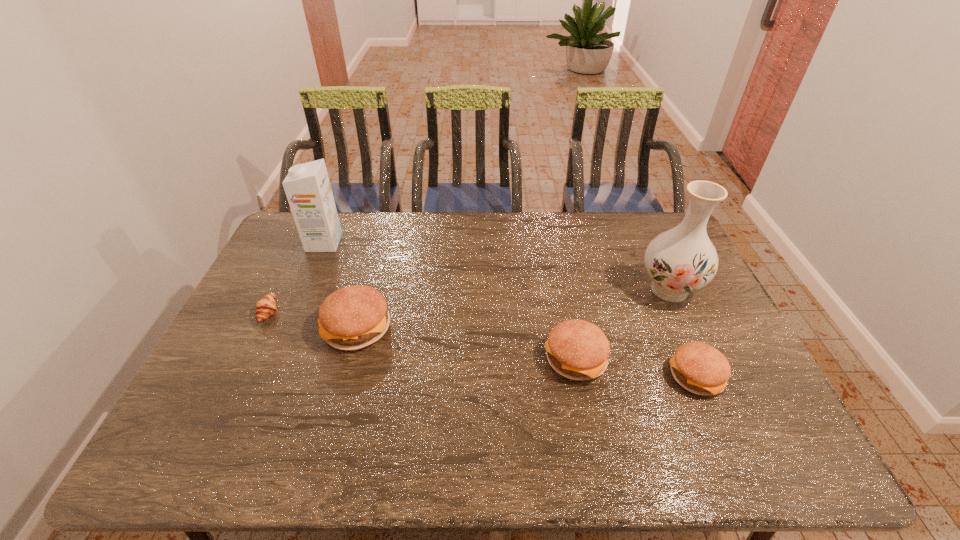
Choose which hamburger is the second nearest neighbor to the vase. Please provide its 2D coordinates. Your answer should be formatted as a tuple, i.e. [(x, y)], where the tuple contains the x and y coordinates of a point satisfying the conditions above.

[(576, 349)]

You are a GUI agent. You are given a task and a screenshot of the screen. Output one action in this format:
    pyautogui.click(x=<x>, y=<y>)
    Task: Click on the vacant space that satisfies the following two spatial constraints: 1. on the front-facing side of the pastry; 2. on the right side of the fourth object from left to right
    The height and width of the screenshot is (540, 960).
    Given the screenshot: What is the action you would take?
    pyautogui.click(x=245, y=359)

Identify the location of vacant space that satisfies the following two spatial constraints: 1. on the back side of the shortest hamburger; 2. on the front-facing side of the pastry. The image size is (960, 540). (668, 312).

Identify the location of free space that satisfies the following two spatial constraints: 1. on the front side of the fourth object from left to right; 2. on the left side of the leftmost hamburger. (348, 359).

You are a GUI agent. You are given a task and a screenshot of the screen. Output one action in this format:
    pyautogui.click(x=<x>, y=<y>)
    Task: Click on the vacant space that satisfies the following two spatial constraints: 1. on the front-facing side of the pastry; 2. on the back side of the shortest hamburger
    
    Given the screenshot: What is the action you would take?
    pyautogui.click(x=236, y=377)